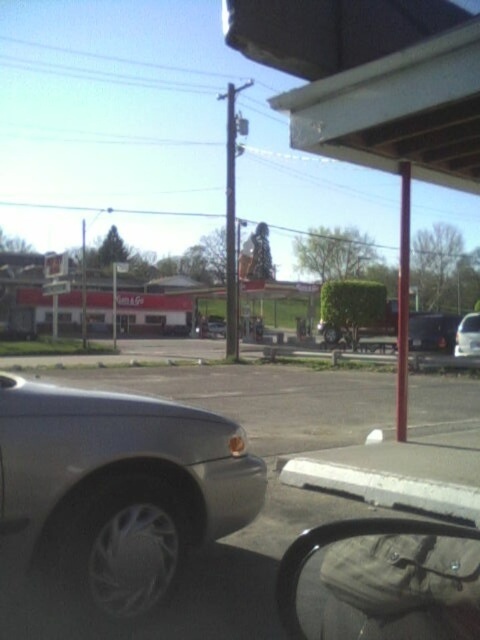
You are driving a car and need to park in the gray asphalt parking lot at center. The satin black sedan at center is blocking your way. Can you drive around it to access the parking lot?

The gray asphalt parking lot at center is in front of the satin black sedan at center, so you cannot drive around it to access the parking lot because the sedan is directly blocking the entrance.

You are a delivery driver who needs to park your vehicle in the gray asphalt parking lot at center. There is a silver metallic car at lower left blocking the entrance. Can you drive around it to access the parking lot?

The silver metallic car at lower left is to the left of the gray asphalt parking lot at center, so you can drive around it on the right side to access the parking lot.

You are a delivery driver who needs to park your truck in the parking lot. The truck is 2.5 meters wide. Can you fit your truck into the gray asphalt parking lot at center if the satin black sedan at center is already parked there?

The gray asphalt parking lot at center might be wider than satin black sedan at center, so it is possible that the truck can fit. However, without exact measurements, it is uncertain.